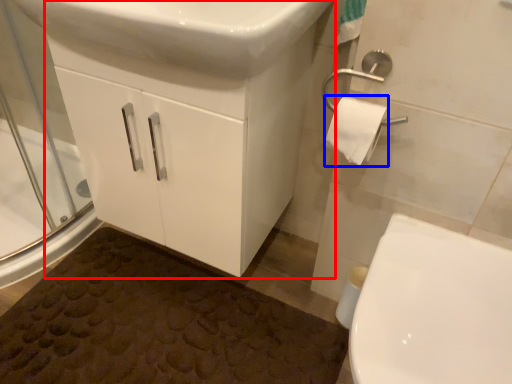
Question: Which object is closer to the camera taking this photo, bathroom cabinet (highlighted by a red box) or toilet paper (highlighted by a blue box)?

Choices:
 (A) bathroom cabinet
 (B) toilet paper

Answer: (A)